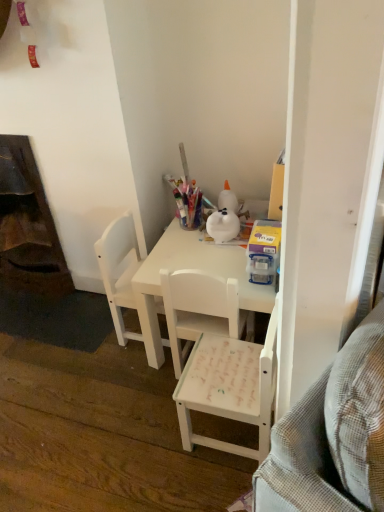
Question: From the image's perspective, is white matte chair at center, which ranks as the 2th chair in left-to-right order, above translucent plastic container at upper right?

Choices:
 (A) yes
 (B) no

Answer: (B)

Question: Is white matte chair at center, which ranks as the 2th chair in left-to-right order, far away from translucent plastic container at upper right?

Choices:
 (A) yes
 (B) no

Answer: (B)

Question: Is white matte chair at center, which ranks as the 2th chair in left-to-right order, taller than translucent plastic container at upper right?

Choices:
 (A) yes
 (B) no

Answer: (A)

Question: Considering the relative positions of white matte chair at center, placed as the second chair when sorted from right to left, and translucent plastic container at upper right in the image provided, is white matte chair at center, placed as the second chair when sorted from right to left, to the left of translucent plastic container at upper right from the viewer's perspective?

Choices:
 (A) no
 (B) yes

Answer: (B)

Question: Would you say white matte chair at center, which ranks as the 2th chair in left-to-right order, contains translucent plastic container at upper right?

Choices:
 (A) no
 (B) yes

Answer: (A)

Question: Is dark wood fireplace at left inside or outside of white matte chair at center, which is the 3th chair in left-to-right order?

Choices:
 (A) outside
 (B) inside

Answer: (A)

Question: From the image's perspective, relative to white matte chair at center, which is the 3th chair in left-to-right order, is dark wood fireplace at left above or below?

Choices:
 (A) above
 (B) below

Answer: (A)

Question: Is point (56, 252) closer or farther from the camera than point (246, 347)?

Choices:
 (A) closer
 (B) farther

Answer: (B)

Question: Is dark wood fireplace at left in front of or behind white matte chair at center, which is the 3th chair in left-to-right order, in the image?

Choices:
 (A) behind
 (B) front

Answer: (A)

Question: From the image's perspective, is dark wood fireplace at left located above or below white matte chair at center, which is counted as the third chair, starting from the right?

Choices:
 (A) below
 (B) above

Answer: (B)

Question: Is dark wood fireplace at left in front of or behind white matte chair at center, which is counted as the third chair, starting from the right, in the image?

Choices:
 (A) behind
 (B) front

Answer: (A)

Question: From a real-world perspective, is dark wood fireplace at left positioned above or below white matte chair at center, which is counted as the third chair, starting from the right?

Choices:
 (A) below
 (B) above

Answer: (B)

Question: Is point (26, 237) positioned closer to the camera than point (127, 226)?

Choices:
 (A) closer
 (B) farther

Answer: (B)

Question: Which is correct: white matte chair at center, which ranks as the 2th chair in left-to-right order, is inside translucent plastic container at upper right, or outside of it?

Choices:
 (A) inside
 (B) outside

Answer: (B)

Question: Considering their positions, is white matte chair at center, placed as the second chair when sorted from right to left, located in front of or behind translucent plastic container at upper right?

Choices:
 (A) behind
 (B) front

Answer: (B)